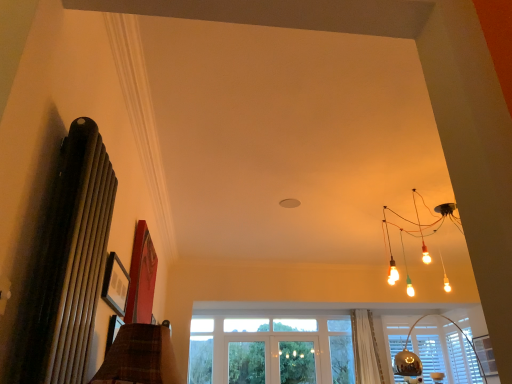
Question: Do you think metallic silver lampshade at lower right is within matte black picture frame at upper left, or outside of it?

Choices:
 (A) inside
 (B) outside

Answer: (B)

Question: Considering the positions of metallic silver lampshade at lower right and matte black picture frame at upper left in the image, is metallic silver lampshade at lower right taller or shorter than matte black picture frame at upper left?

Choices:
 (A) short
 (B) tall

Answer: (B)

Question: Estimate the real-world distances between objects in this image. Which object is farther from the white sheer curtain at lower center?

Choices:
 (A) translucent glass screen door at center
 (B) matte black picture frame at upper left
 (C) metallic silver lampshade at lower right

Answer: (B)

Question: Considering the real-world distances, which object is farthest from the metallic silver lampshade at lower right?

Choices:
 (A) matte black picture frame at upper left
 (B) white sheer curtain at lower center
 (C) translucent glass screen door at center

Answer: (A)